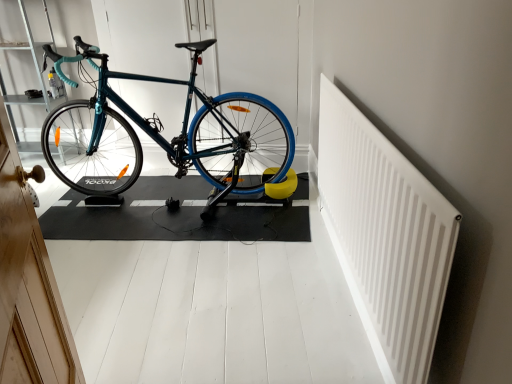
Question: Considering the positions of point (x=133, y=155) and point (x=18, y=54), is point (x=133, y=155) closer or farther from the camera than point (x=18, y=54)?

Choices:
 (A) farther
 (B) closer

Answer: (B)

Question: From their relative heights in the image, would you say teal glossy bicycle at center is taller or shorter than teal matte bicycle handlebar at upper left?

Choices:
 (A) short
 (B) tall

Answer: (A)

Question: Which object is positioned farthest from the teal glossy bicycle at center?

Choices:
 (A) white plastic radiator at upper right
 (B) teal matte bicycle handlebar at upper left

Answer: (A)

Question: Which is farther from the teal matte bicycle handlebar at upper left?

Choices:
 (A) teal glossy bicycle at center
 (B) white plastic radiator at upper right

Answer: (B)